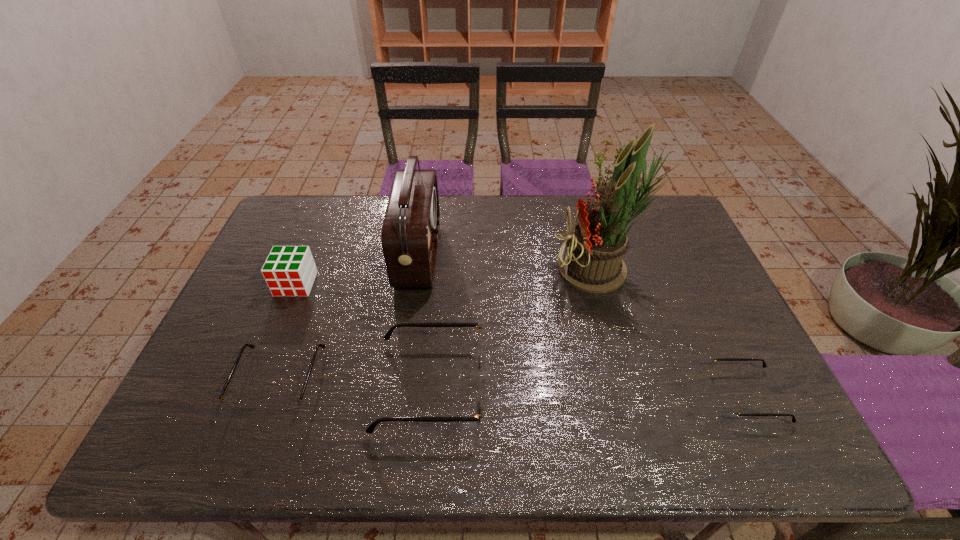
Locate an element on the screen. This screenshot has height=540, width=960. the leftmost spectacles is located at coordinates coord(284,405).

The height and width of the screenshot is (540, 960). I want to click on the second shortest spectacles, so click(x=284, y=405).

I want to click on the second spectacles from left to right, so click(481, 352).

In order to click on the third shortest object in this screenshot , I will do [481, 352].

Find the location of a particular element. the shortest object is located at coordinates (729, 407).

The image size is (960, 540). What are the coordinates of `the rightmost spectacles` in the screenshot? It's located at (729, 407).

At what (x,y) coordinates should I click in order to perform the action: click on the second object from right to left. Please return your answer as a coordinate pair (x, y). Looking at the image, I should click on (591, 260).

Identify the location of flower arrangement. (591, 260).

At what (x,y) coordinates should I click in order to perform the action: click on the second tallest object. Please return your answer as a coordinate pair (x, y). The height and width of the screenshot is (540, 960). Looking at the image, I should click on (410, 232).

At what (x,y) coordinates should I click in order to perform the action: click on cube. Please return your answer as a coordinate pair (x, y). Image resolution: width=960 pixels, height=540 pixels. Looking at the image, I should click on (288, 270).